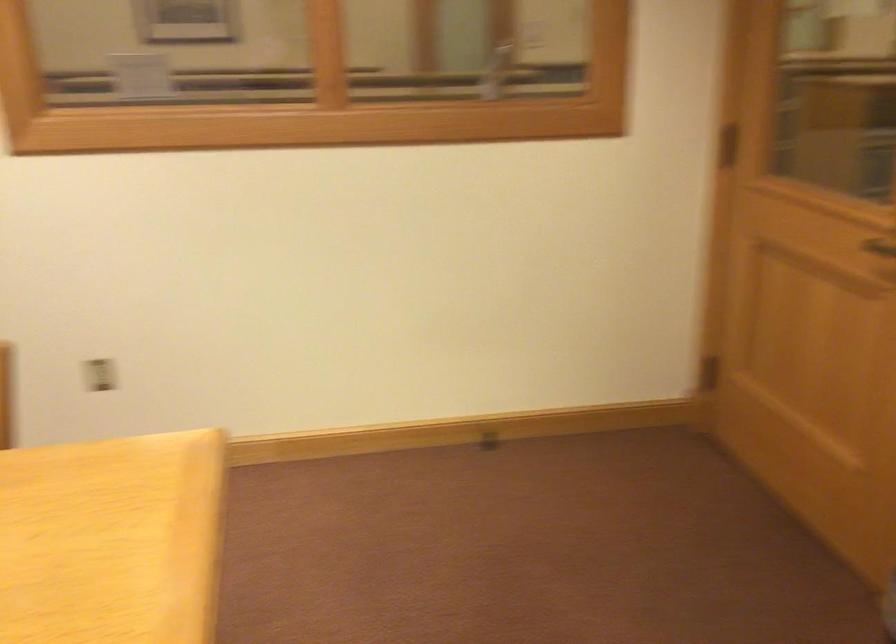
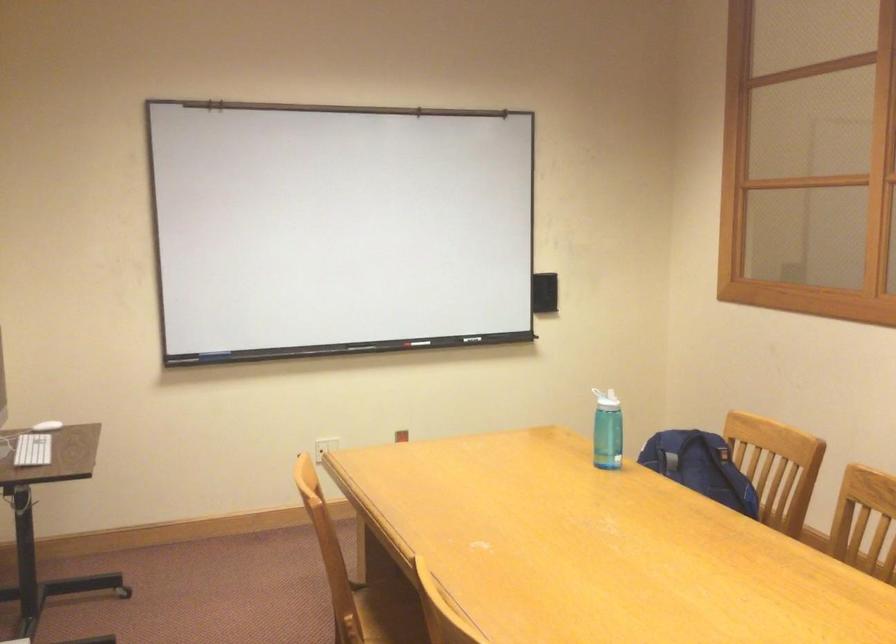
Question: Based on the continuous images, in which direction is the camera rotating? Reply with the corresponding letter.

Choices:
 (A) Left
 (B) Right
 (C) Up
 (D) Down

Answer: (A)